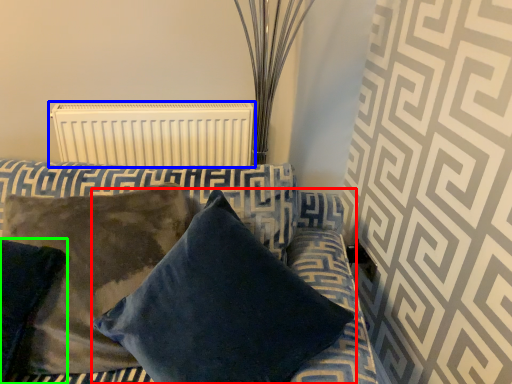
Question: Which is nearer to the pillow (highlighted by a red box)? radiator (highlighted by a blue box) or pillow (highlighted by a green box).

Choices:
 (A) radiator
 (B) pillow

Answer: (B)